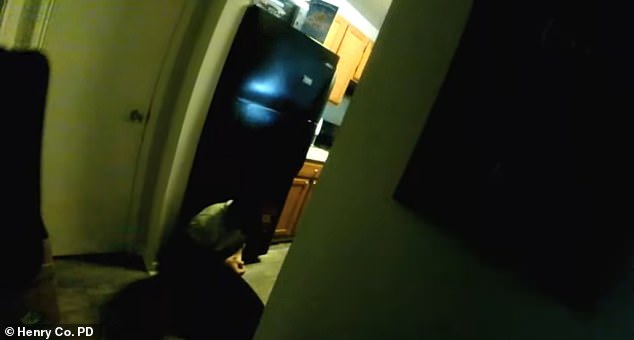
At what (x,y) coordinates should I click in order to perform the action: click on black fridge. Please return your answer as a coordinate pair (x, y). Looking at the image, I should click on (x=273, y=84), (x=261, y=149).